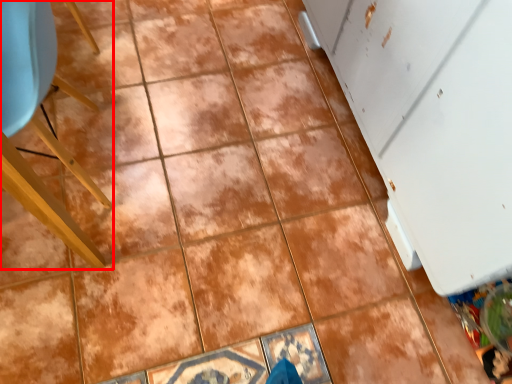
Question: Considering the relative positions of furniture (annotated by the red box) and screen door in the image provided, where is furniture (annotated by the red box) located with respect to the staircase?

Choices:
 (A) left
 (B) right

Answer: (A)